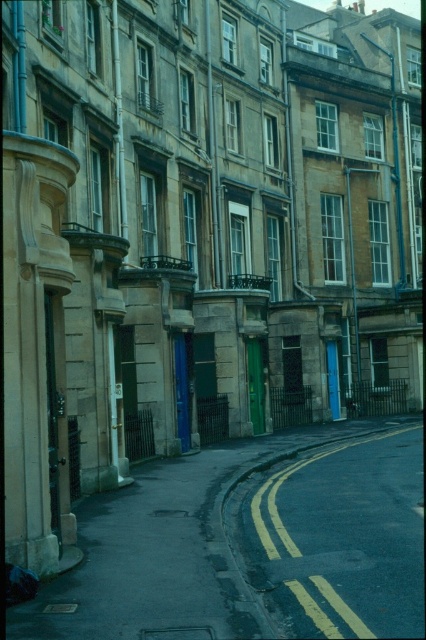
Question: Does smooth asphalt road at center have a lesser width compared to yellow asphalt at center?

Choices:
 (A) no
 (B) yes

Answer: (A)

Question: Can you confirm if smooth asphalt road at center is positioned to the right of yellow asphalt at center?

Choices:
 (A) no
 (B) yes

Answer: (A)

Question: Which point is farther to the camera?

Choices:
 (A) (412, 556)
 (B) (339, 627)

Answer: (A)

Question: Is smooth asphalt road at center wider than yellow asphalt at center?

Choices:
 (A) no
 (B) yes

Answer: (B)

Question: Which object appears farthest from the camera in this image?

Choices:
 (A) yellow asphalt at center
 (B) smooth asphalt road at center

Answer: (A)